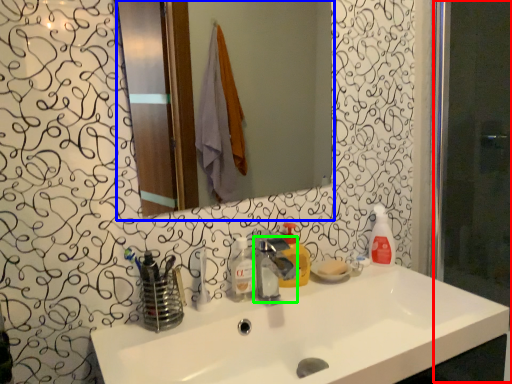
Question: Based on their relative distances, which object is nearer to screen door (highlighted by a red box)? Choose from mirror (highlighted by a blue box) and tap (highlighted by a green box).

Choices:
 (A) mirror
 (B) tap

Answer: (B)